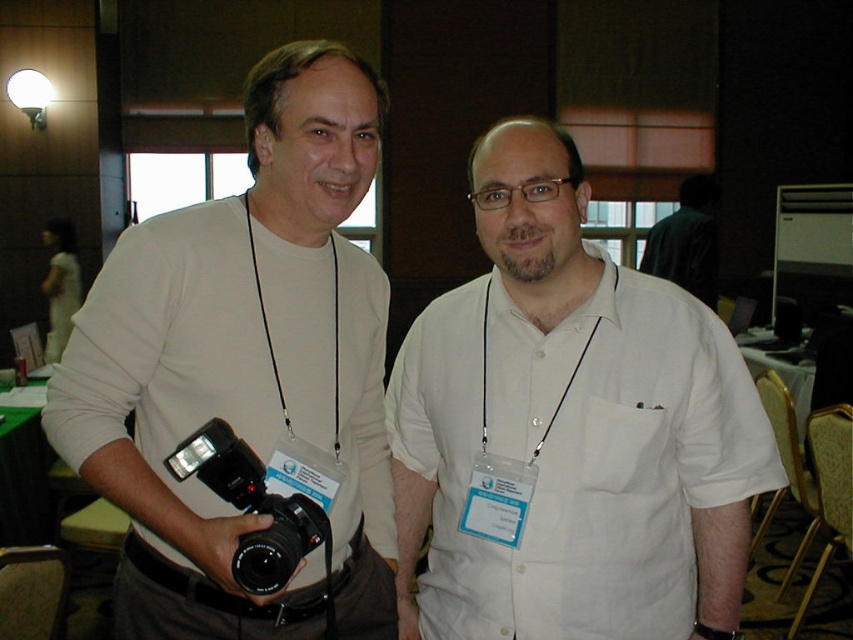
Looking at this image, you are organizing a photo shoot and need to ensure that the white cotton shirt at center and the black plastic camera at left are both visible in the frame. Given their sizes, which object will occupy more space in the photo?

The white cotton shirt at center is larger in size than the black plastic camera at left, so it will occupy more space in the photo.

You are a photographer at a conference and need to position your matte white camera at left and black plastic camera at left for a setup. Given their positions, which camera is closer to the left edge of the image?

The matte white camera at left is closer to the left edge of the image because it is positioned to the left of the black plastic camera at left.

You are organizing a photo shoot and need to position the matte white camera at left so that it faces the white cotton shirt at center. Based on their current positions, will the camera be able to capture the shirt in its field of view?

The matte white camera at left is in front of the white cotton shirt at center, so the camera is positioned closer to the shirt. However, since the camera is in front of the shirt, it may not be able to capture the shirt in its field of view unless it is angled backward. Without additional information about the camera angle or field of view, it is uncertain if the shirt will be visible in the photo.